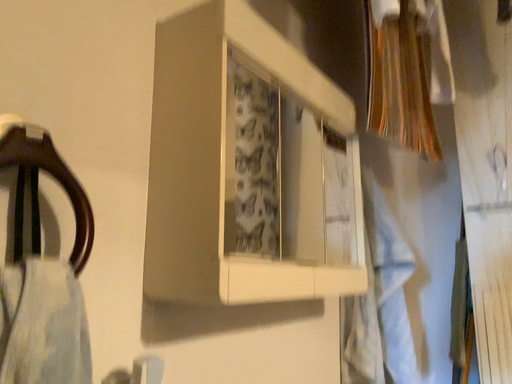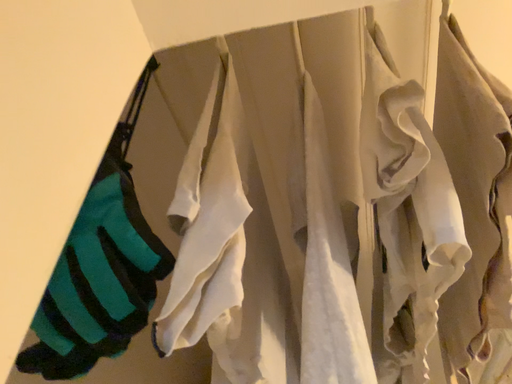
Question: Which way did the camera rotate in the video?

Choices:
 (A) rotated right
 (B) rotated left

Answer: (A)